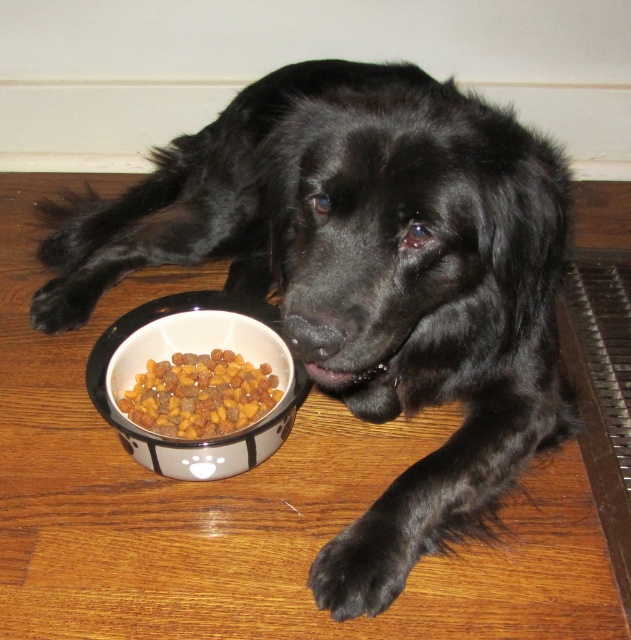
You are a pet owner who wants to ensure your dog can easily reach its food. Based on the scene, is the white glossy bowl at lower left placed to the left or right of the brown crunchy kibble at lower left?

The white glossy bowl at lower left is positioned on the left side of brown crunchy kibble at lower left, so the bowl is to the left of the kibble.

You are standing in front of the black dog lying on the wooden floor. You want to place a new toy exactly where the white glossy bowl at lower left is located. What are the coordinates where you should place the toy?

You should place the toy at coordinates point (x=192, y=349) where the white glossy bowl at lower left is located.